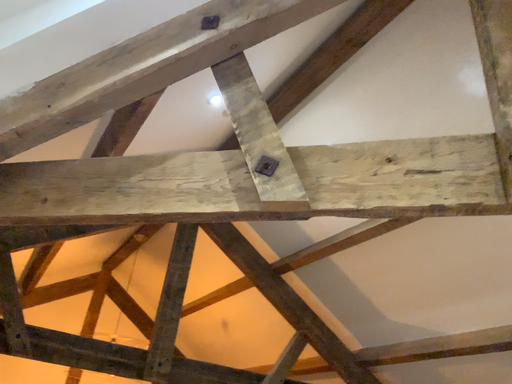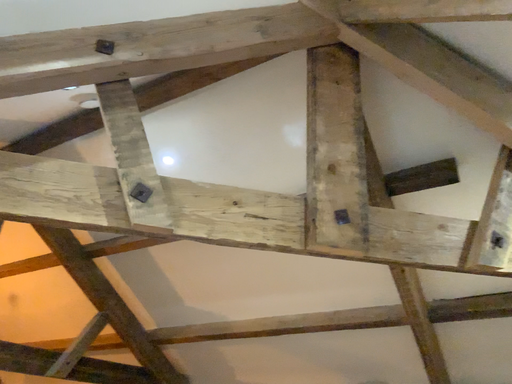
Question: Which way did the camera rotate in the video?

Choices:
 (A) rotated upward
 (B) rotated downward

Answer: (B)